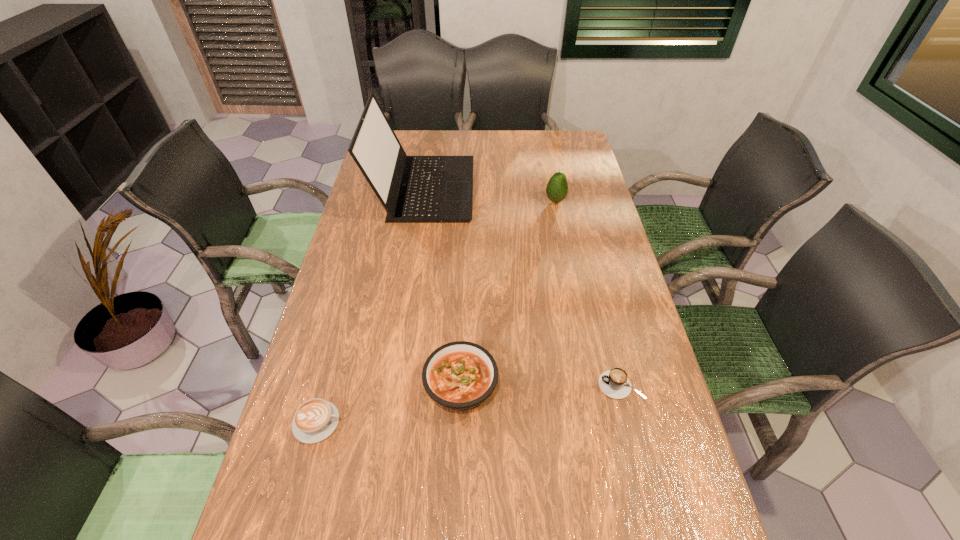
I want to click on laptop, so click(413, 189).

Locate an element on the screen. Image resolution: width=960 pixels, height=540 pixels. the second tallest object is located at coordinates (557, 187).

Find the location of a particular element. The height and width of the screenshot is (540, 960). stew is located at coordinates pos(460,375).

I want to click on the right cappuccino, so click(614, 383).

Locate an element on the screen. the taller cappuccino is located at coordinates (614, 383).

The height and width of the screenshot is (540, 960). I want to click on the left cappuccino, so click(x=316, y=419).

Identify the location of the shorter cappuccino. Image resolution: width=960 pixels, height=540 pixels. (316, 419).

The height and width of the screenshot is (540, 960). In order to click on free point located on the surface of the tallest object in this screenshot , I will do [x=543, y=188].

The height and width of the screenshot is (540, 960). In order to click on vacant space located 0.300m on the back of the fourth shortest object in this screenshot , I will do [x=545, y=151].

Identify the location of free spot located 0.180m on the front of the third shortest object. This screenshot has width=960, height=540. (457, 507).